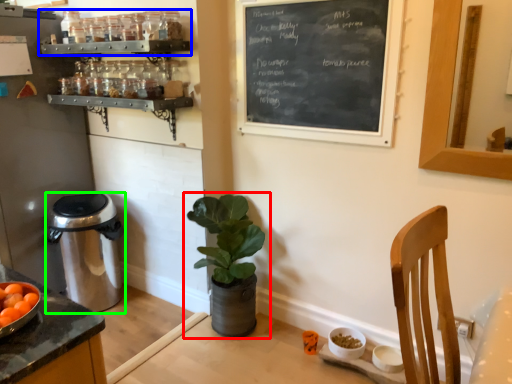
Question: Estimate the real-world distances between objects in this image. Which object is closer to houseplant (highlighted by a red box), shelf (highlighted by a blue box) or trash bin/can (highlighted by a green box)?

Choices:
 (A) shelf
 (B) trash bin/can

Answer: (B)